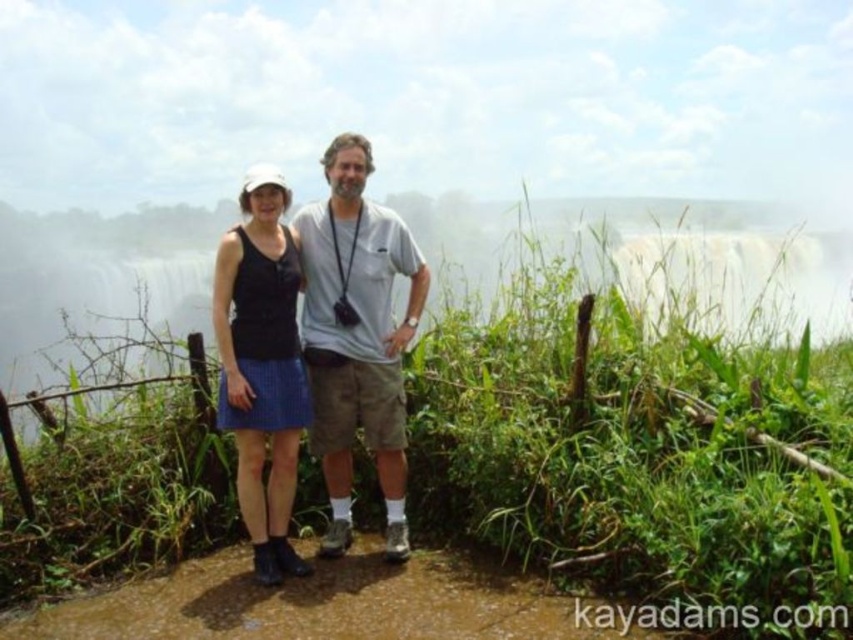
Based on the photo, can you confirm if gray cotton t-shirt at center is positioned to the left of matte black tank top at center?

Incorrect, gray cotton t-shirt at center is not on the left side of matte black tank top at center.

Can you confirm if gray cotton t-shirt at center is positioned above matte black tank top at center?

Yes, gray cotton t-shirt at center is above matte black tank top at center.

Which is behind, point (320, 381) or point (251, 506)?

Point (320, 381)

Image resolution: width=853 pixels, height=640 pixels. I want to click on gray cotton t-shirt at center, so click(x=357, y=337).

Which is in front, point (412, 195) or point (270, 280)?

Point (270, 280)

Where is `green leafy shrubs at center`? The image size is (853, 640). green leafy shrubs at center is located at coordinates (641, 403).

Describe the element at coordinates (641, 403) in the screenshot. I see `green leafy shrubs at center` at that location.

Find the location of a particular element. This screenshot has width=853, height=640. green leafy shrubs at center is located at coordinates (641, 403).

Find the location of `green leafy shrubs at center`. green leafy shrubs at center is located at coordinates (641, 403).